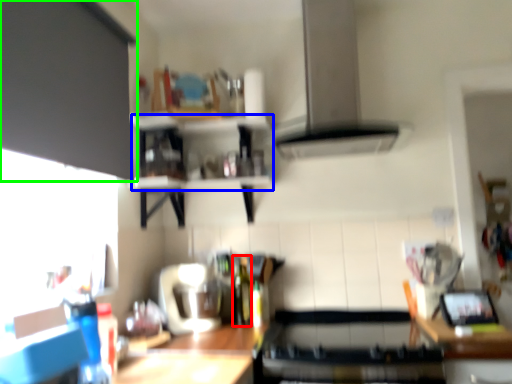
Question: Which is farther away from bottle (highlighted by a red box)? shelf (highlighted by a blue box) or cabinetry (highlighted by a green box)?

Choices:
 (A) shelf
 (B) cabinetry

Answer: (B)